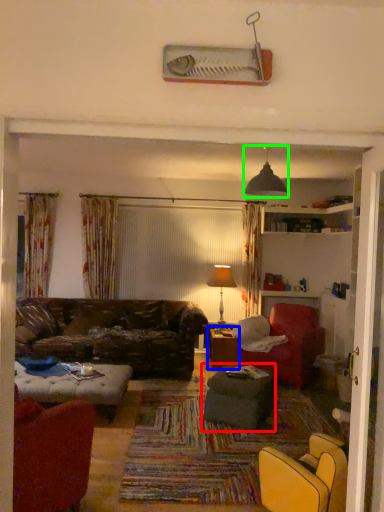
Question: Which object is positioned farthest from table (highlighted by a red box)? Select from table (highlighted by a blue box) and light fixture (highlighted by a green box).

Choices:
 (A) table
 (B) light fixture

Answer: (B)